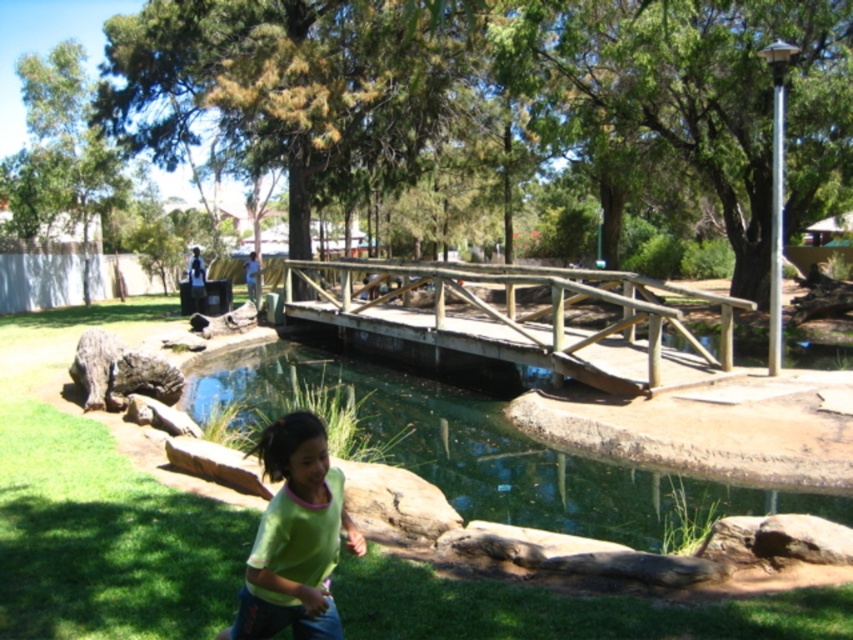
Does clear water at bridge center lie behind wooden bridge at center?

No, it is not.

Does point (500, 440) come behind point (534, 356)?

No, (500, 440) is in front of (534, 356).

Which is in front, point (648, 513) or point (514, 364)?

Point (648, 513) is more forward.

Locate an element on the screen. The image size is (853, 640). clear water at bridge center is located at coordinates (473, 451).

Based on the photo, between wooden bridge at center and green matte shirt at lower center, which one appears on the left side from the viewer's perspective?

green matte shirt at lower center

Is wooden bridge at center to the right of green matte shirt at lower center from the viewer's perspective?

Indeed, wooden bridge at center is positioned on the right side of green matte shirt at lower center.

Measure the distance between point (506,273) and camera.

They are 15.30 meters apart.

Find the location of a particular element. This screenshot has height=640, width=853. wooden bridge at center is located at coordinates (520, 321).

Measure the distance from clear water at bridge center to green matte shirt at lower center.

The distance of clear water at bridge center from green matte shirt at lower center is 6.19 meters.

Between clear water at bridge center and green matte shirt at lower center, which one has less height?

clear water at bridge center

Is point (514, 488) less distant than point (354, 525)?

No.

This screenshot has width=853, height=640. I want to click on clear water at bridge center, so [473, 451].